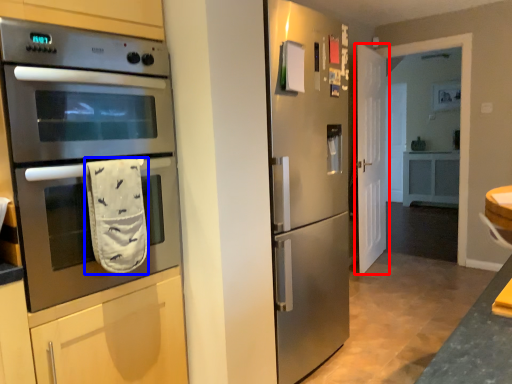
Question: Which point is further to the camera, door (highlighted by a red box) or hand towel (highlighted by a blue box)?

Choices:
 (A) door
 (B) hand towel

Answer: (A)